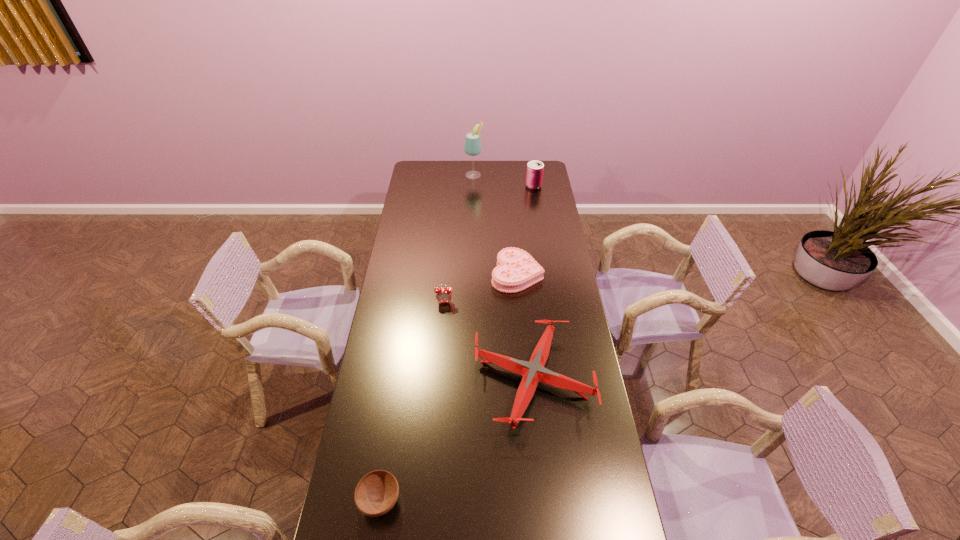
Locate an element on the screen. This screenshot has width=960, height=540. drone that is at the right edge is located at coordinates (533, 372).

What are the coordinates of `cake present at the right edge` in the screenshot? It's located at (516, 270).

Locate an element on the screen. The image size is (960, 540). object that is at the far right corner is located at coordinates pyautogui.click(x=534, y=176).

Find the location of a particular element. This screenshot has height=540, width=960. vacant space at the far edge of the desktop is located at coordinates (513, 173).

The width and height of the screenshot is (960, 540). What are the coordinates of `blank space at the left edge` in the screenshot? It's located at (354, 468).

Identify the location of vacant space at the right edge. The width and height of the screenshot is (960, 540). (530, 195).

Locate an element on the screen. The height and width of the screenshot is (540, 960). vacant space at the far left corner of the desktop is located at coordinates (422, 177).

Where is `free space between the second tallest object and the fourth nearest object`? free space between the second tallest object and the fourth nearest object is located at coordinates [x=525, y=230].

Where is `empty space that is in between the second object from left to right and the second nearest object`? The width and height of the screenshot is (960, 540). empty space that is in between the second object from left to right and the second nearest object is located at coordinates (489, 341).

This screenshot has height=540, width=960. Identify the location of vacant space that is in between the nearest object and the can. (457, 343).